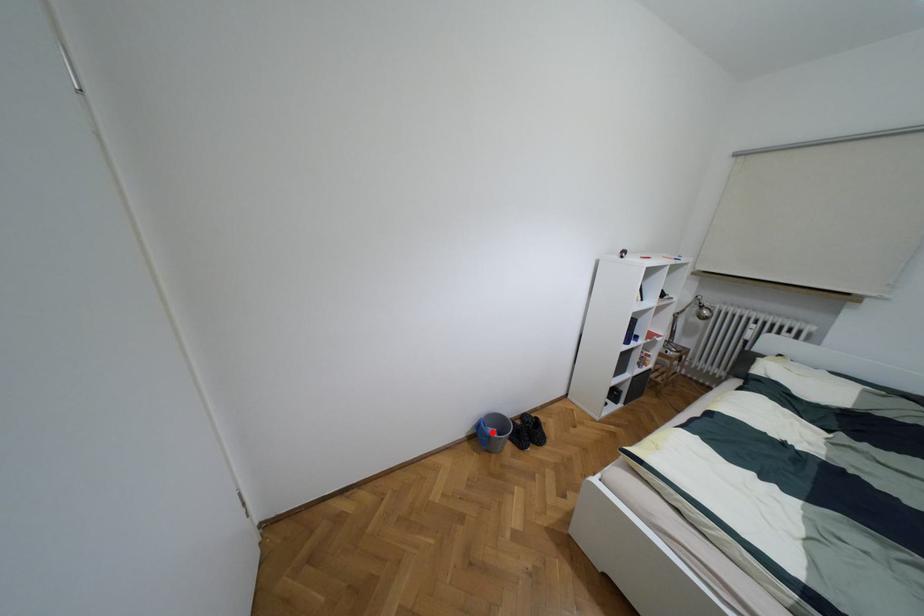
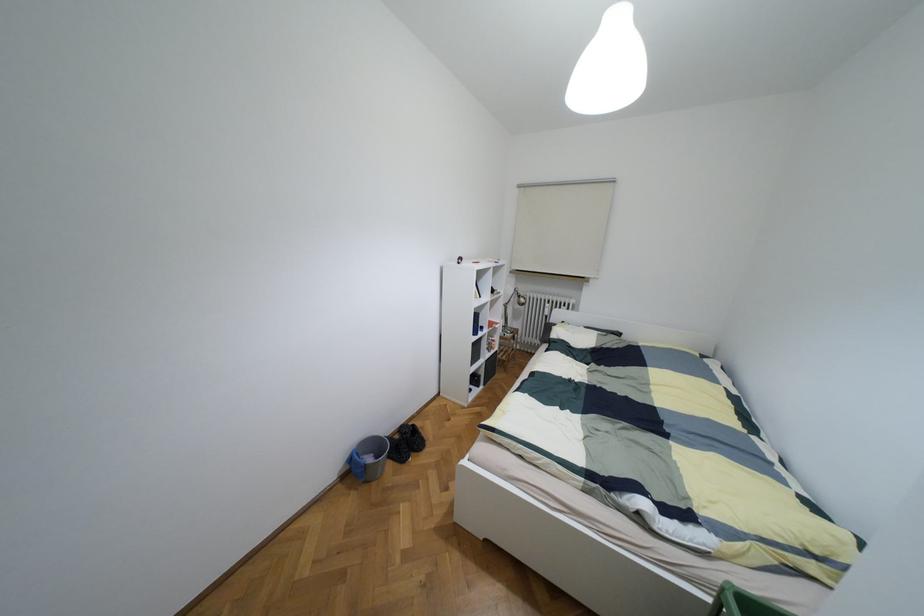
Question: I am providing you with two images of the same scene from different viewpoints. A red point is marked on the first image. At the location where the point appears in image 1, is it still visible in image 2?

Choices:
 (A) Yes
 (B) No

Answer: (A)